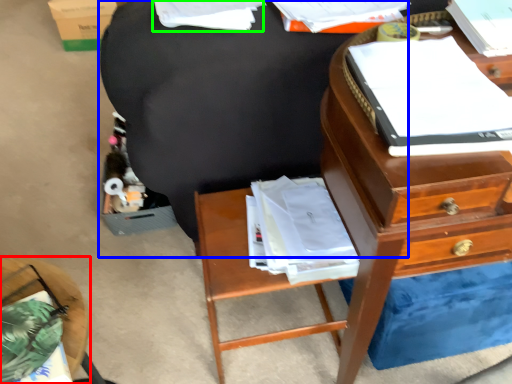
Question: Which is farther away from nightstand (highlighted by a red box)? bean bag chair (highlighted by a blue box) or book (highlighted by a green box)?

Choices:
 (A) bean bag chair
 (B) book

Answer: (B)